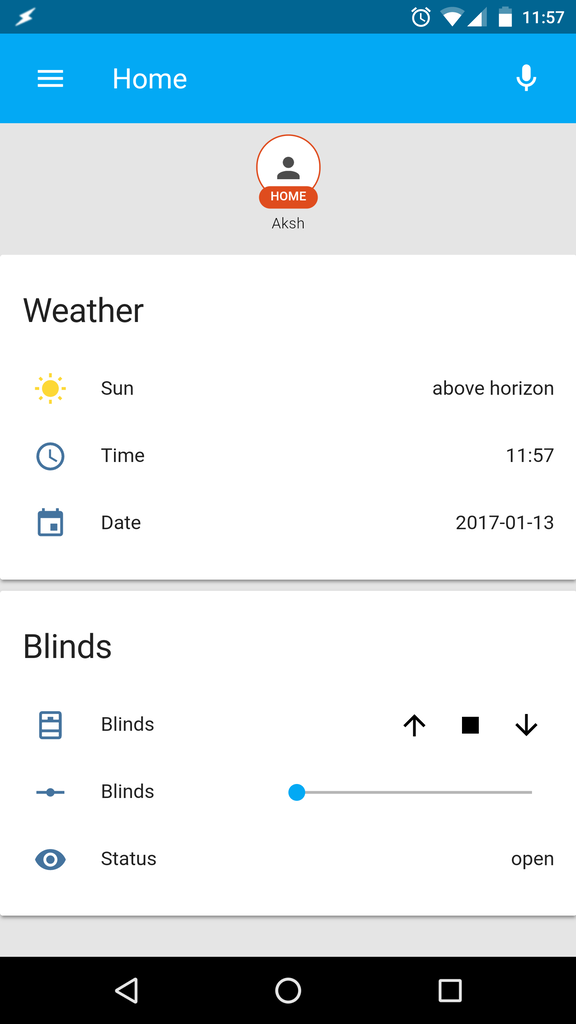
I want to click on divider, so click(x=150, y=580).